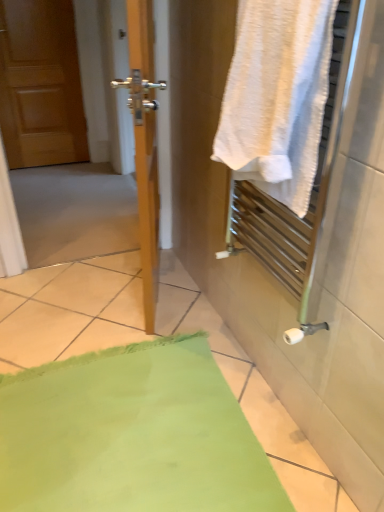
Describe the element at coordinates (131, 435) in the screenshot. I see `green fabric bath mat at lower left` at that location.

The width and height of the screenshot is (384, 512). Find the location of `matte wood door at left`. matte wood door at left is located at coordinates (40, 84).

The image size is (384, 512). Identify the location of wooden screen door at left. (148, 211).

You are a GUI agent. You are given a task and a screenshot of the screen. Output one action in this format:
    pyautogui.click(x=<x>, y=<y>)
    Task: Click on the green fabric bath mat at lower left
    
    Given the screenshot: What is the action you would take?
    pyautogui.click(x=131, y=435)

Where is `screen door to the right of matte wood door at left`? The height and width of the screenshot is (512, 384). screen door to the right of matte wood door at left is located at coordinates (148, 211).

From a real-world perspective, between wooden screen door at left and matte wood door at left, who is vertically higher?

matte wood door at left.

Can you confirm if wooden screen door at left is positioned to the right of matte wood door at left?

Indeed, wooden screen door at left is positioned on the right side of matte wood door at left.

Considering their positions, is wooden screen door at left located in front of or behind matte wood door at left?

wooden screen door at left is in front of matte wood door at left.

Does white textured towel at right appear on the left side of wooden screen door at left?

Incorrect, white textured towel at right is not on the left side of wooden screen door at left.

How far apart are white textured towel at right and wooden screen door at left?

18.12 inches.

Is white textured towel at right wider than wooden screen door at left?

Correct, the width of white textured towel at right exceeds that of wooden screen door at left.

Is white textured towel at right smaller than wooden screen door at left?

Indeed, white textured towel at right has a smaller size compared to wooden screen door at left.

From the picture: Is green fabric bath mat at lower left outside of white textured towel at right?

That's correct, green fabric bath mat at lower left is outside of white textured towel at right.

Could you tell me if green fabric bath mat at lower left is turned towards white textured towel at right?

No, green fabric bath mat at lower left is not aimed at white textured towel at right.

Can you confirm if green fabric bath mat at lower left is taller than white textured towel at right?

In fact, green fabric bath mat at lower left may be shorter than white textured towel at right.

Does point (170, 378) come closer to viewer compared to point (259, 154)?

No, (170, 378) is behind (259, 154).

Which is more to the right, white textured towel at right or matte wood door at left?

white textured towel at right.

Is matte wood door at left surrounded by white textured towel at right?

No, white textured towel at right does not contain matte wood door at left.

Is white textured towel at right wider than matte wood door at left?

Yes, white textured towel at right is wider than matte wood door at left.

Is matte wood door at left turned away from green fabric bath mat at lower left?

matte wood door at left is not turned away from green fabric bath mat at lower left.

Which is in front, matte wood door at left or green fabric bath mat at lower left?

Positioned in front is green fabric bath mat at lower left.

In the scene shown: Does matte wood door at left have a lesser height compared to green fabric bath mat at lower left?

No, matte wood door at left is not shorter than green fabric bath mat at lower left.

Considering the positions of objects matte wood door at left and green fabric bath mat at lower left in the image provided, who is more to the right, matte wood door at left or green fabric bath mat at lower left?

green fabric bath mat at lower left.

What's the angular difference between white textured towel at right and green fabric bath mat at lower left's facing directions?

88.9 degrees.

Considering the sizes of objects white textured towel at right and green fabric bath mat at lower left in the image provided, who is bigger, white textured towel at right or green fabric bath mat at lower left?

Bigger between the two is green fabric bath mat at lower left.

In terms of height, does white textured towel at right look taller or shorter compared to green fabric bath mat at lower left?

Considering their sizes, white textured towel at right has more height than green fabric bath mat at lower left.

From the image's perspective, which one is positioned higher, white textured towel at right or green fabric bath mat at lower left?

white textured towel at right appears higher in the image.

Which is more to the left, wooden screen door at left or white textured towel at right?

wooden screen door at left is more to the left.

Is wooden screen door at left wider than white textured towel at right?

No.

Does point (2, 12) come behind point (269, 154)?

Yes, it is behind point (269, 154).

Considering the relative sizes of wooden screen door at left and white textured towel at right in the image provided, is wooden screen door at left bigger than white textured towel at right?

Yes.

The image size is (384, 512). Find the location of `screen door directly beneath the matte wood door at left (from a real-world perspective)`. screen door directly beneath the matte wood door at left (from a real-world perspective) is located at coordinates (148, 211).

Locate an element on the screen. towel below the wooden screen door at left (from the image's perspective) is located at coordinates coord(277,97).

From the image, which object appears to be farther from wooden screen door at left, white textured towel at right or green fabric bath mat at lower left?

green fabric bath mat at lower left lies further to wooden screen door at left than the other object.

Which object lies nearer to the anchor point matte wood door at left, wooden screen door at left or white textured towel at right?

wooden screen door at left.

Estimate the real-world distances between objects in this image. Which object is closer to green fabric bath mat at lower left, wooden screen door at left or white textured towel at right?

wooden screen door at left lies closer to green fabric bath mat at lower left than the other object.

When comparing their distances from green fabric bath mat at lower left, does wooden screen door at left or matte wood door at left seem closer?

The object closer to green fabric bath mat at lower left is wooden screen door at left.

Based on their spatial positions, is white textured towel at right or matte wood door at left closer to wooden screen door at left?

white textured towel at right is closer to wooden screen door at left.

Based on their spatial positions, is wooden screen door at left or green fabric bath mat at lower left further from white textured towel at right?

Based on the image, green fabric bath mat at lower left appears to be further to white textured towel at right.

Which object lies nearer to the anchor point green fabric bath mat at lower left, white textured towel at right or matte wood door at left?

Among the two, white textured towel at right is located nearer to green fabric bath mat at lower left.

From the image, which object appears to be farther from green fabric bath mat at lower left, white textured towel at right or wooden screen door at left?

Among the two, white textured towel at right is located further to green fabric bath mat at lower left.

I want to click on screen door positioned between green fabric bath mat at lower left and matte wood door at left from near to far, so click(x=148, y=211).

I want to click on bath mat between white textured towel at right and matte wood door at left in the front-back direction, so click(x=131, y=435).

Identify the location of towel that lies between wooden screen door at left and green fabric bath mat at lower left from top to bottom. (277, 97).

This screenshot has height=512, width=384. Find the location of `screen door located between white textured towel at right and matte wood door at left in the depth direction`. screen door located between white textured towel at right and matte wood door at left in the depth direction is located at coordinates (148, 211).